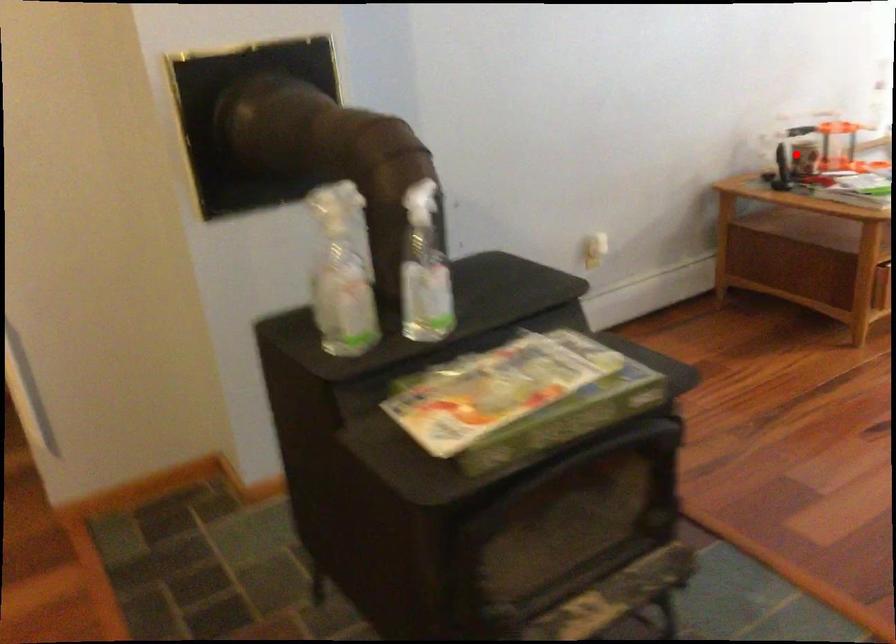
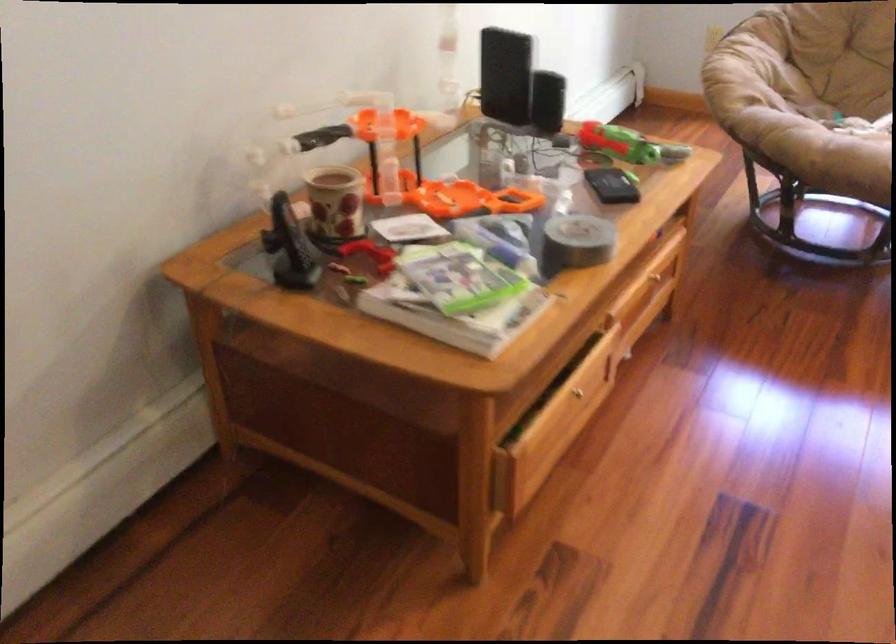
Question: I am providing you with two images of the same scene from different viewpoints. Given a red point in image1, look at the same physical point in image2. Is it:

Choices:
 (A) Closer to the viewpoint
 (B) Farther from the viewpoint

Answer: (A)